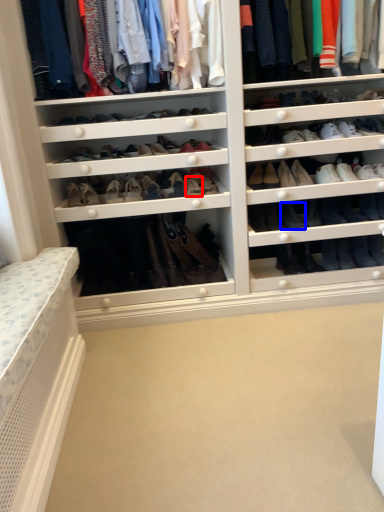
Question: Which point is closer to the camera, shoe (highlighted by a red box) or shoe (highlighted by a blue box)?

Choices:
 (A) shoe
 (B) shoe

Answer: (A)